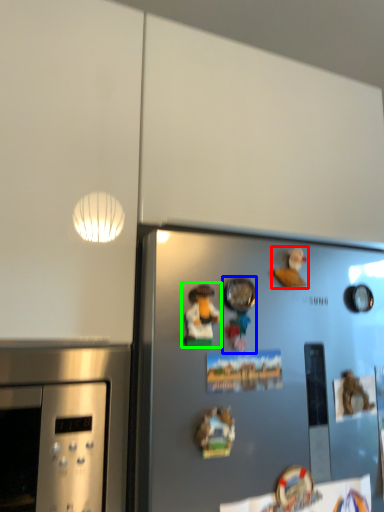
Question: Based on their relative distances, which object is farther from toy (highlighted by a red box)? Choose from toy (highlighted by a blue box) and art (highlighted by a green box).

Choices:
 (A) toy
 (B) art

Answer: (B)